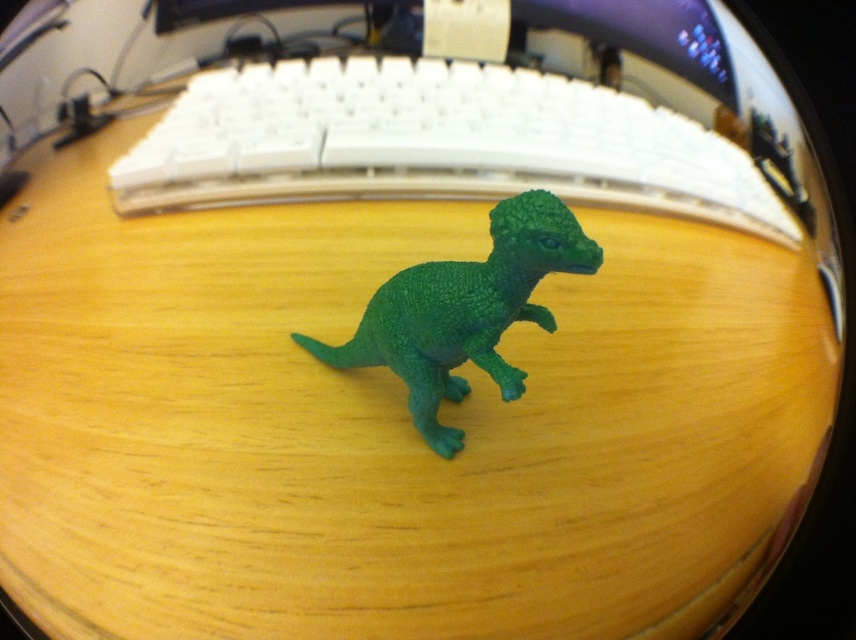
You are organizing items on your desk and need to place both the white plastic keyboard at center and the green matte plastic dinosaur at center. Since you want to stack them, which one should go on the bottom to support the other?

The white plastic keyboard at center should be placed on the bottom because it has a greater height compared to the green matte plastic dinosaur at center, making it more stable for stacking.

You are organizing your desk and want to move the green matte plastic dinosaur at center so it doesn t block the white plastic keyboard at center. Based on the current arrangement, is the dinosaur already positioned in a way that might be obstructing the keyboard?

The green matte plastic dinosaur at center is behind the white plastic keyboard at center, so it is currently positioned behind the keyboard and not obstructing it. However, if the keyboard is in front, the dinosaur might not be blocking the keyboard visually but could still be taking up space behind it. To ensure it doesn t interfere with cables or access to the keyboard, you may want to adjust its position.

You need to place the small green plastic dinosaur figurine on the desk so that it is directly to the left of the white plastic keyboard at center. Based on the current setup, where should you position the dinosaur?

The white plastic keyboard at center is located at point (435, 141). To place the dinosaur directly to the left of it, position the dinosaur at a coordinate with the same y value of 0.509 and an x value less than 0.223, such as (435, 128).